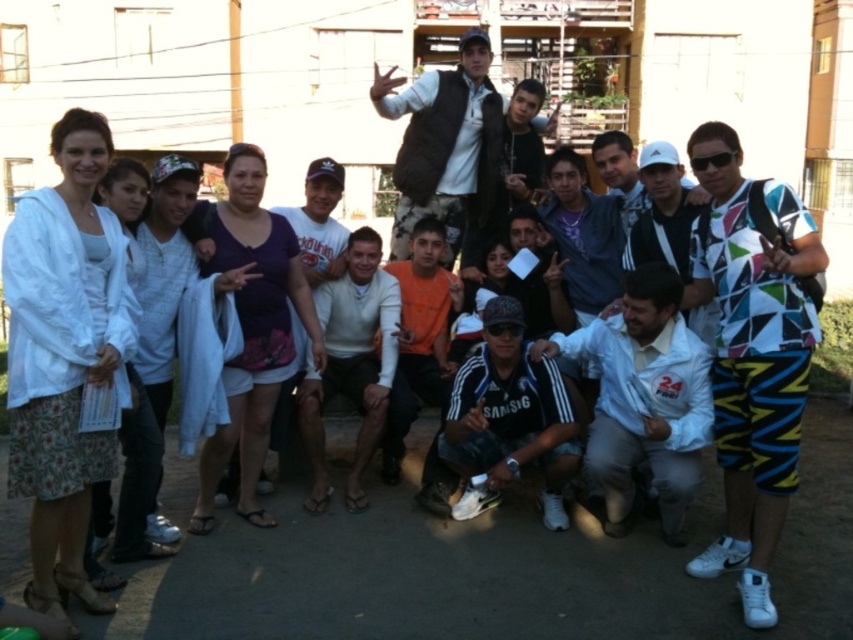
You are a photographer trying to capture a clear shot of both the white adidas cap at center and the white cap at center. Since they are both at the center, how can you ensure both are visible in the photo?

The white adidas cap at center has a smaller size compared to white cap at center. To ensure both are visible, position the camera so that the smaller white adidas cap at center is not entirely obscured by the larger white cap at center, perhaps by adjusting the angle or zoom level to accommodate their size difference.

You are a photographer trying to capture a clear shot of both the multicolored geometric shirt at center and the black adidas jersey at center. Which of the two items should you focus on first if you want to ensure the larger one is in sharp focus?

The multicolored geometric shirt at center is bigger than the black adidas jersey at center, so you should focus on the multicolored geometric shirt at center first to ensure it is in sharp focus.

You are a photographer trying to capture a group photo of the multicolored geometric shirt at center and the black adidas jersey at center. Since you want to ensure both subjects are in focus, you need to know their height difference. Which of the two is taller?

The multicolored geometric shirt at center is taller than the black adidas jersey at center, so the multicolored geometric shirt at center is taller.